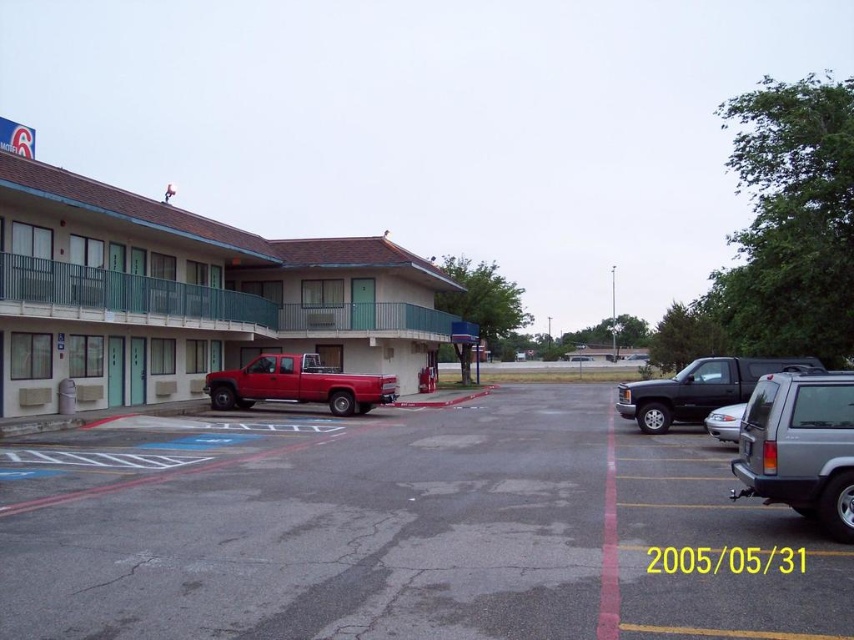
You are a delivery driver with a 2.5 meter long box that needs to be placed between the smooth asphalt parking lot at center and the silver metallic suv at right. Can the box fit in the space between them?

The smooth asphalt parking lot at center is 6.36 meters from the silver metallic suv at right. Since the box is 2.5 meters long, it can easily fit in the space between them as the distance is more than sufficient.

You are driving a delivery van and need to park in the motel parking lot. You see the smooth asphalt parking lot at center and the silver metallic suv at right. Which parking space should you choose to park your van if you want to be closer to the motel entrance?

The smooth asphalt parking lot at center is in front of the silver metallic suv at right, so parking there would place you closer to the motel entrance.

From the picture: You are standing at the entrance of the motel and want to walk to the point marked by point (539, 628) and point (825, 512). Which point should you reach first to stay on the path that goes towards the back of the parking lot?

You should reach point (539, 628) first because it is in front of point (825, 512), meaning it is closer to the entrance and thus comes first on the path towards the back of the parking lot.